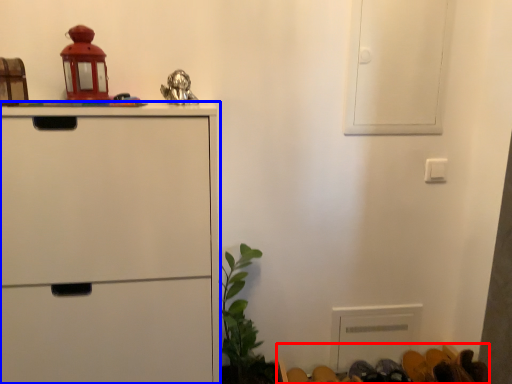
Question: Which object appears closest to the camera in this image, furniture (highlighted by a red box) or chest of drawers (highlighted by a blue box)?

Choices:
 (A) furniture
 (B) chest of drawers

Answer: (B)